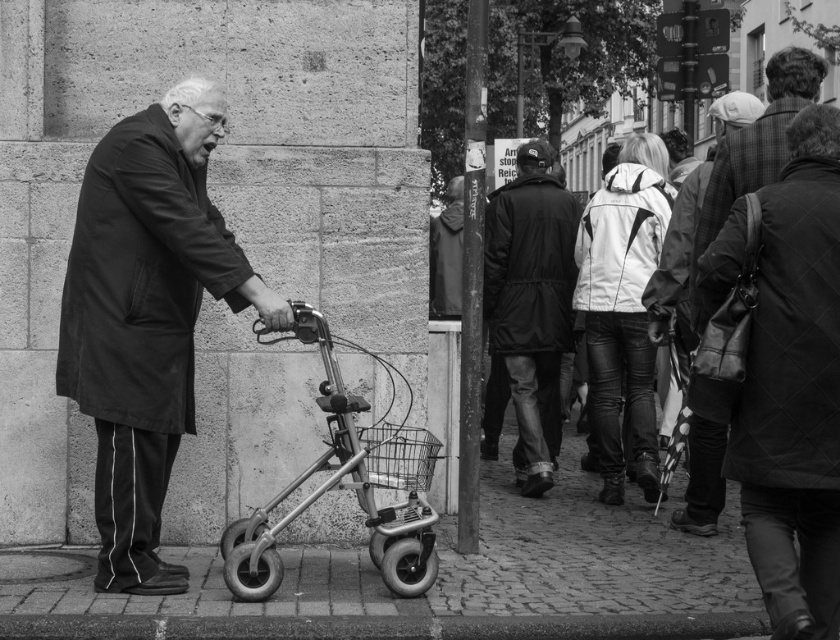
You are a delivery person who needs to place a small package on the metallic pavement at lower center. However, there is a metallic wire basket at lower center in the way. Can you still place the package on the pavement without moving the basket?

The metallic pavement at lower center is larger in size than the metallic wire basket at lower center, so there is still space to place the package on the pavement without moving the basket.

You are a delivery person who needs to place a small package on the metallic pavement at lower center or the leather jacket at center. Which surface is more suitable for placing the package?

The metallic pavement at lower center has a smaller size compared to the leather jacket at center, so the leather jacket at center is more suitable for placing the package as it offers a larger surface area.

You are a delivery robot positioned at the point labeled as point (x=457, y=580). You need to navigate to a metallic pavement at lower center. Is your current position exactly on the metallic pavement at lower center?

Yes, because the point (x=457, y=580) is where the metallic pavement at lower center is located.